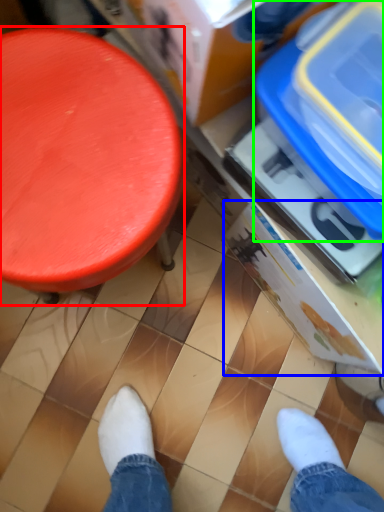
Question: Based on their relative distances, which object is farther from furniture (highlighted by a red box)? Choose from storage box (highlighted by a blue box) and storage box (highlighted by a green box).

Choices:
 (A) storage box
 (B) storage box

Answer: (A)